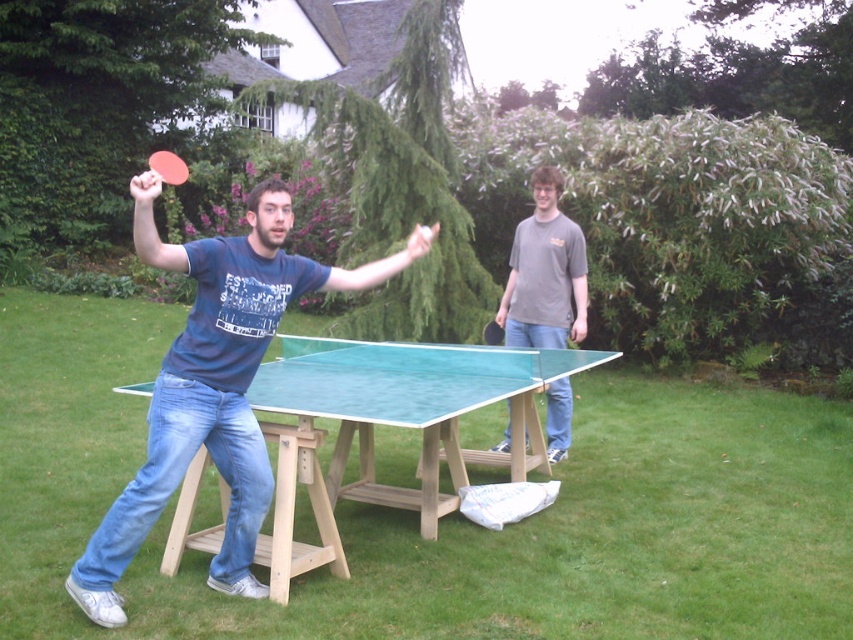
Is point (548, 262) farther from camera compared to point (498, 336)?

No, it is in front of (498, 336).

Which is in front, point (521, 252) or point (486, 339)?

Point (521, 252) is in front.

Is point (567, 390) farther from viewer compared to point (503, 339)?

No, it is in front of (503, 339).

Where is `gray cotton t-shirt at center`? gray cotton t-shirt at center is located at coordinates [x=544, y=273].

Does green matte table tennis table at center appear under black rubber paddle at center?

No, green matte table tennis table at center is not below black rubber paddle at center.

Does green matte table tennis table at center appear over black rubber paddle at center?

Yes.

Where is `green matte table tennis table at center`? This screenshot has height=640, width=853. green matte table tennis table at center is located at coordinates (167, 166).

The width and height of the screenshot is (853, 640). In order to click on green matte table tennis table at center in this screenshot , I will do `click(167, 166)`.

Is green wooden table at center above green matte table tennis table at center?

Actually, green wooden table at center is below green matte table tennis table at center.

Is green wooden table at center behind green matte table tennis table at center?

Yes.

What do you see at coordinates (390, 426) in the screenshot?
I see `green wooden table at center` at bounding box center [390, 426].

What are the coordinates of `green wooden table at center` in the screenshot? It's located at (390, 426).